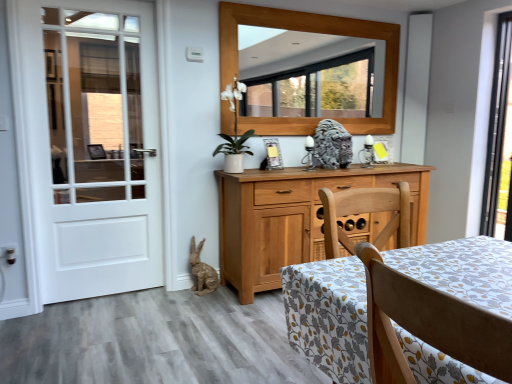
Question: From the image's perspective, is burlap-textured rabbit at lower left, arranged as the first animal when viewed from the left, above matte wooden picture frame at center?

Choices:
 (A) yes
 (B) no

Answer: (B)

Question: Does burlap-textured rabbit at lower left, arranged as the first animal when viewed from the left, appear on the left side of matte wooden picture frame at center?

Choices:
 (A) no
 (B) yes

Answer: (B)

Question: Could you tell me if burlap-textured rabbit at lower left, acting as the 1th animal starting from the bottom, is turned towards matte wooden picture frame at center?

Choices:
 (A) yes
 (B) no

Answer: (B)

Question: Is matte wooden picture frame at center located within burlap-textured rabbit at lower left, acting as the 1th animal starting from the bottom?

Choices:
 (A) no
 (B) yes

Answer: (A)

Question: Is burlap-textured rabbit at lower left, which is counted as the 2th animal, starting from the right, in contact with matte wooden picture frame at center?

Choices:
 (A) yes
 (B) no

Answer: (B)

Question: Is point (334, 150) closer or farther from the camera than point (194, 241)?

Choices:
 (A) farther
 (B) closer

Answer: (A)

Question: Is gray stone lion at center, the first animal from the top, in front of or behind burlap-textured rabbit at lower left, arranged as the first animal when viewed from the left, in the image?

Choices:
 (A) behind
 (B) front

Answer: (A)

Question: From the image's perspective, is gray stone lion at center, the 1th animal positioned from the right, above or below burlap-textured rabbit at lower left, arranged as the first animal when viewed from the left?

Choices:
 (A) below
 (B) above

Answer: (B)

Question: Based on their sizes in the image, would you say gray stone lion at center, the first animal from the top, is bigger or smaller than burlap-textured rabbit at lower left, the 2th animal viewed from the top?

Choices:
 (A) small
 (B) big

Answer: (B)

Question: Is burlap-textured rabbit at lower left, acting as the 1th animal starting from the bottom, spatially inside matte wooden picture frame at center, or outside of it?

Choices:
 (A) inside
 (B) outside

Answer: (B)

Question: From a real-world perspective, is burlap-textured rabbit at lower left, arranged as the first animal when viewed from the left, physically located above or below matte wooden picture frame at center?

Choices:
 (A) below
 (B) above

Answer: (A)

Question: Looking at their shapes, would you say burlap-textured rabbit at lower left, which is counted as the 2th animal, starting from the right, is wider or thinner than matte wooden picture frame at center?

Choices:
 (A) wide
 (B) thin

Answer: (A)

Question: From the image's perspective, relative to matte wooden picture frame at center, is burlap-textured rabbit at lower left, which is counted as the 2th animal, starting from the right, above or below?

Choices:
 (A) below
 (B) above

Answer: (A)

Question: Considering the relative positions of light brown wood chair at lower right and white wooden door at left in the image provided, is light brown wood chair at lower right to the left or to the right of white wooden door at left?

Choices:
 (A) right
 (B) left

Answer: (A)

Question: Would you say light brown wood chair at lower right is inside or outside white wooden door at left?

Choices:
 (A) outside
 (B) inside

Answer: (A)